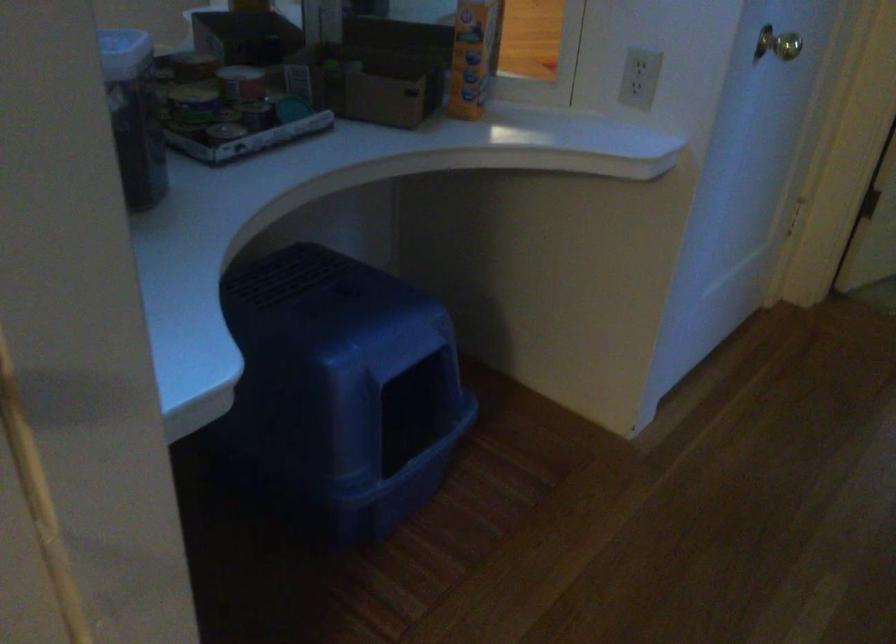
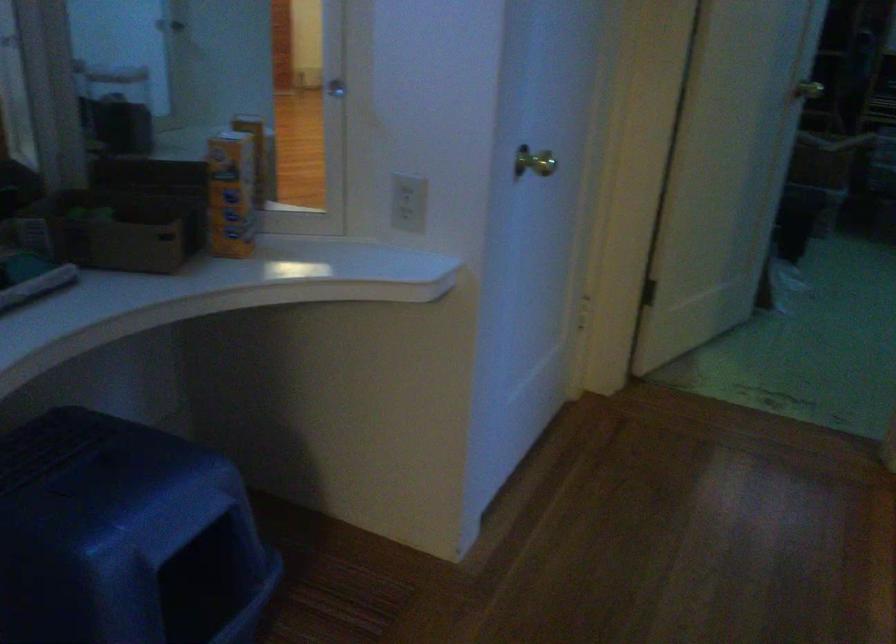
The point at (383,90) is marked in the first image. Where is the corresponding point in the second image?

(138, 238)